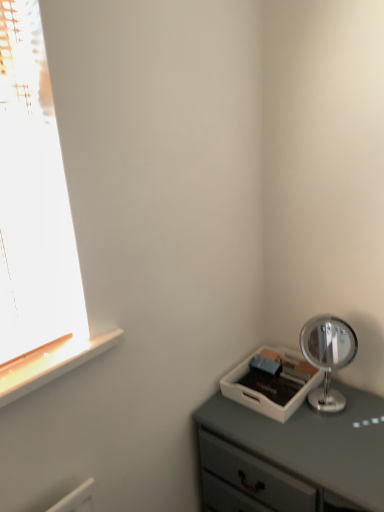
Question: In terms of size, does polished silver mirror at right appear bigger or smaller than white plastic tray at lower right?

Choices:
 (A) big
 (B) small

Answer: (B)

Question: From the image's perspective, is polished silver mirror at right located above or below white plastic tray at lower right?

Choices:
 (A) below
 (B) above

Answer: (B)

Question: Relative to white plastic tray at lower right, is polished silver mirror at right in front or behind?

Choices:
 (A) behind
 (B) front

Answer: (A)

Question: From a real-world perspective, is white plastic tray at lower right physically located above or below polished silver mirror at right?

Choices:
 (A) above
 (B) below

Answer: (B)

Question: Looking at their shapes, would you say white plastic tray at lower right is wider or thinner than polished silver mirror at right?

Choices:
 (A) wide
 (B) thin

Answer: (A)

Question: Is white plastic tray at lower right inside the boundaries of polished silver mirror at right, or outside?

Choices:
 (A) inside
 (B) outside

Answer: (B)

Question: Is point (347, 432) closer or farther from the camera than point (332, 404)?

Choices:
 (A) closer
 (B) farther

Answer: (A)